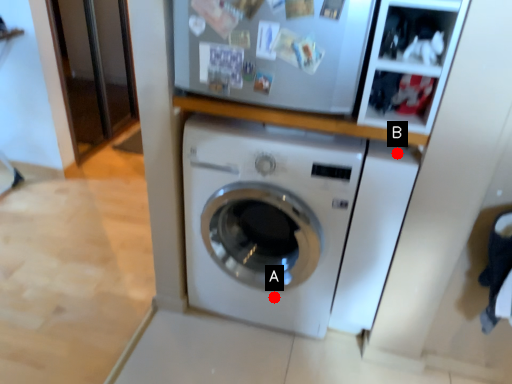
Question: Two points are circled on the image, labeled by A and B beside each circle. Which of the following is the farthest from the observer?

Choices:
 (A) A is further
 (B) B is further

Answer: (A)